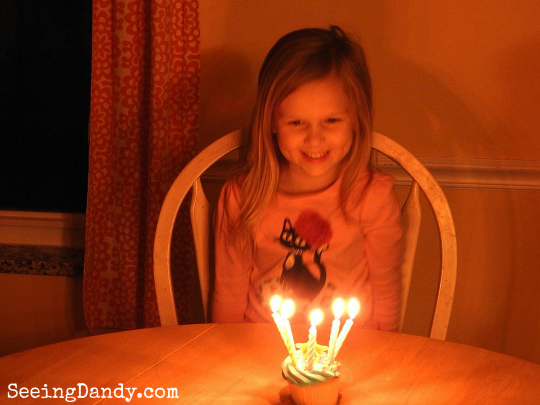
The height and width of the screenshot is (405, 540). I want to click on window, so click(59, 114).